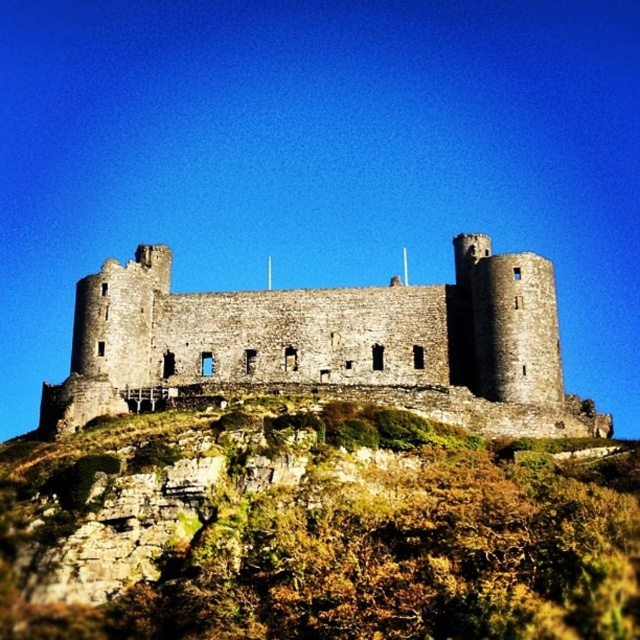
Can you confirm if green mossy rock at center is positioned above stone castle at center?

Incorrect, green mossy rock at center is not positioned above stone castle at center.

Who is shorter, green mossy rock at center or stone castle at center?

green mossy rock at center

Which is behind, point (448, 541) or point (452, 403)?

The point (452, 403) is more distant.

Where is `green mossy rock at center`? green mossy rock at center is located at coordinates (312, 531).